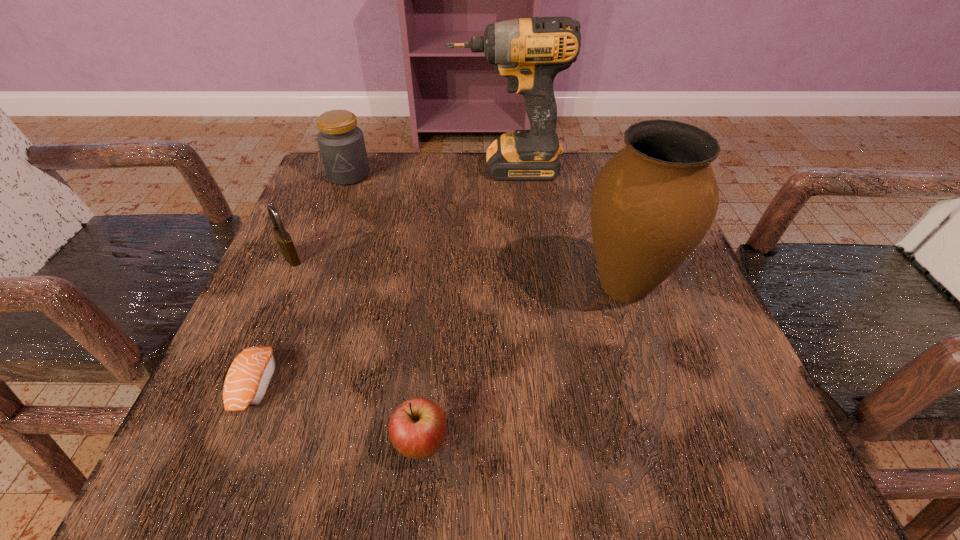
Where is `vacant space in between the sushi and the apple`? Image resolution: width=960 pixels, height=540 pixels. vacant space in between the sushi and the apple is located at coordinates (339, 414).

The image size is (960, 540). Find the location of `free space between the apple and the third shortest object`. free space between the apple and the third shortest object is located at coordinates (356, 350).

Locate an element on the screen. The width and height of the screenshot is (960, 540). free area in between the drill and the urn is located at coordinates (565, 227).

Where is `vacant area that lies between the sushi and the drill`? The width and height of the screenshot is (960, 540). vacant area that lies between the sushi and the drill is located at coordinates (381, 276).

Locate an element on the screen. vacant area between the fourth tallest object and the jar is located at coordinates (320, 216).

At what (x,y) coordinates should I click in order to perform the action: click on vacant area between the drill and the jar. Please return your answer as a coordinate pair (x, y). This screenshot has width=960, height=540. Looking at the image, I should click on (427, 172).

Where is `empty location between the fifth shortest object and the jar`? empty location between the fifth shortest object and the jar is located at coordinates (487, 231).

Where is `empty space between the third shortest object and the drill`? empty space between the third shortest object and the drill is located at coordinates point(398,213).

Image resolution: width=960 pixels, height=540 pixels. I want to click on free space between the drill and the jar, so click(x=427, y=172).

Find the location of a particular element. empty location between the fourth tallest object and the sushi is located at coordinates (274, 321).